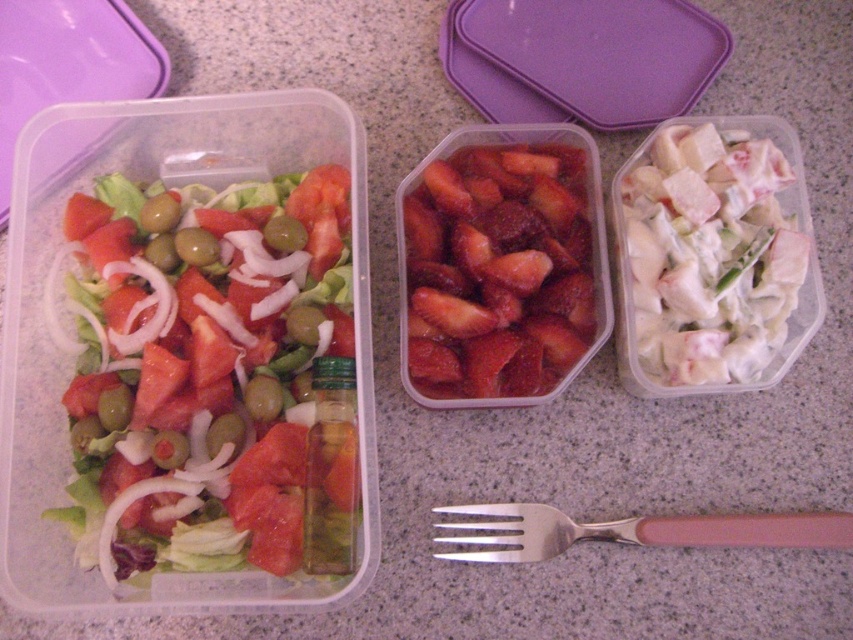
Is fresh green salad at left taller than silver metallic fork at center?

Yes, fresh green salad at left is taller than silver metallic fork at center.

Can you confirm if fresh green salad at left is positioned below silver metallic fork at center?

Incorrect, fresh green salad at left is not positioned below silver metallic fork at center.

Identify the location of fresh green salad at left. The image size is (853, 640). (212, 376).

Which of these two, fresh green salad at left or shiny red strawberries at center, stands shorter?

shiny red strawberries at center is shorter.

Does fresh green salad at left lie behind shiny red strawberries at center?

No.

This screenshot has height=640, width=853. I want to click on fresh green salad at left, so click(212, 376).

Does white creamy chicken salad at right have a lesser width compared to silver metallic fork at center?

Indeed, white creamy chicken salad at right has a lesser width compared to silver metallic fork at center.

Is point (718, 148) behind point (590, 522)?

Yes, point (718, 148) is behind point (590, 522).

Locate an element on the screen. This screenshot has height=640, width=853. white creamy chicken salad at right is located at coordinates (712, 257).